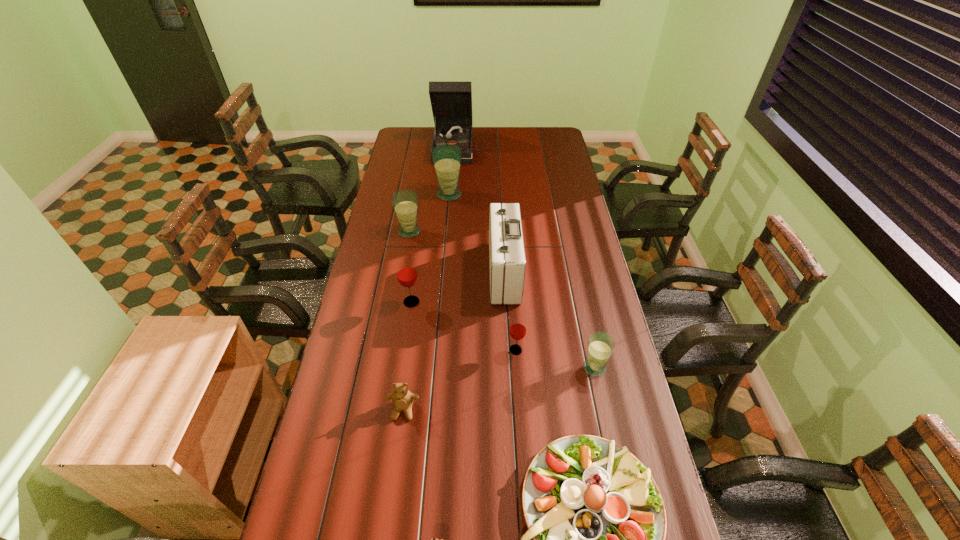
Locate an element on the screen. Image resolution: width=960 pixels, height=540 pixels. blue glass object that ranks as the second closest to the phonograph_record is located at coordinates (405, 201).

The width and height of the screenshot is (960, 540). I want to click on vacant area that satisfies the following two spatial constraints: 1. on the back side of the nearest blue glass; 2. on the front-facing side of the red first-aid kit, so click(x=574, y=272).

You are a GUI agent. You are given a task and a screenshot of the screen. Output one action in this format:
    pyautogui.click(x=<x>, y=<y>)
    Task: Click on the free space that satisfies the following two spatial constraints: 1. on the front-facing side of the red first-aid kit; 2. on the front-facing side of the teddy bear
    The width and height of the screenshot is (960, 540).
    Given the screenshot: What is the action you would take?
    pyautogui.click(x=512, y=410)

Locate an element on the screen. The image size is (960, 540). free space in the image that satisfies the following two spatial constraints: 1. on the front-facing side of the red first-aid kit; 2. on the front-facing side of the teddy bear is located at coordinates (512, 410).

This screenshot has width=960, height=540. I want to click on vacant space that satisfies the following two spatial constraints: 1. on the front side of the rightmost blue glass; 2. on the left side of the farther red glass, so click(x=402, y=368).

Locate an element on the screen. free space that satisfies the following two spatial constraints: 1. on the front side of the tallest glass; 2. on the right side of the rightmost blue glass is located at coordinates (434, 368).

Where is `vacant space that satisfies the following two spatial constraints: 1. on the front-facing side of the first-aid kit; 2. on the right side of the fourth nearest object`? The width and height of the screenshot is (960, 540). vacant space that satisfies the following two spatial constraints: 1. on the front-facing side of the first-aid kit; 2. on the right side of the fourth nearest object is located at coordinates (510, 368).